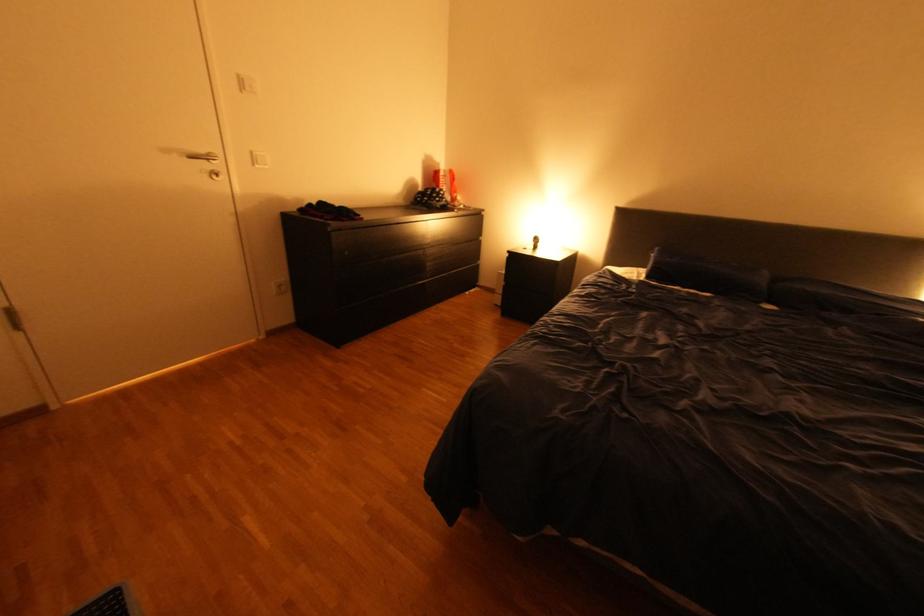
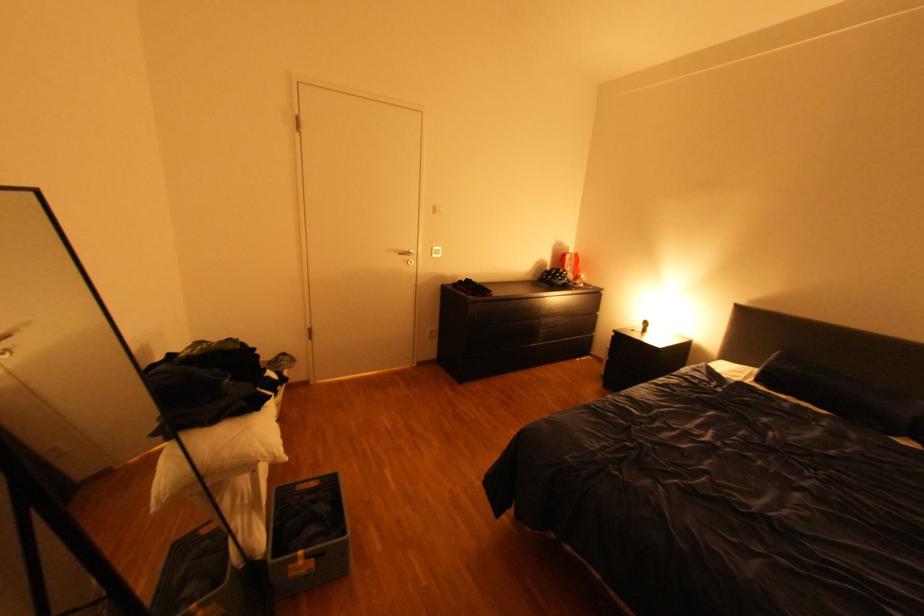
Where in the second image is the point corresponding to the point at 549,244 from the first image?

(659, 328)